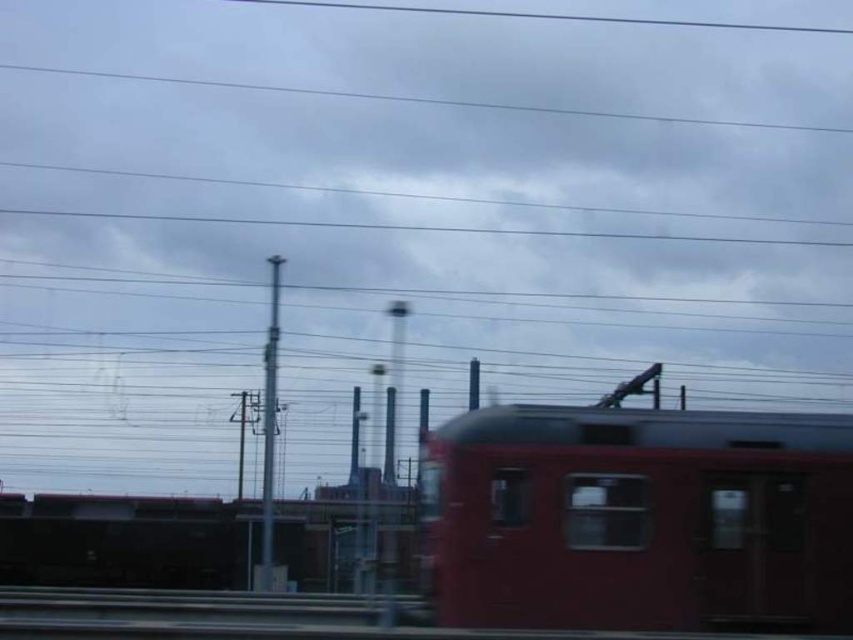
You are a photographer trying to capture the matte red train car at center and the metallic wire at upper center in the same frame. Based on their positions, which object should you adjust your camera to focus on first to ensure both are in the frame?

The matte red train car at center is positioned on the right side of the metallic wire at upper center. To capture both in the frame, focus on the metallic wire at upper center first since it is on the left, allowing you to adjust the camera to include the train car on its right side.

You are standing at the point labeled point (845, 420) and want to walk to point (271, 534). Given that both points are on the same railway platform, which direction should you face to walk directly towards your destination?

Since point (845, 420) is closer to the camera than point (271, 534), you should face away from the camera to walk directly towards point (271, 534).

You are standing at the point labeled point (549, 17) in the image. What is directly above you?

The smooth wire at upper center is directly above the point (549, 17).